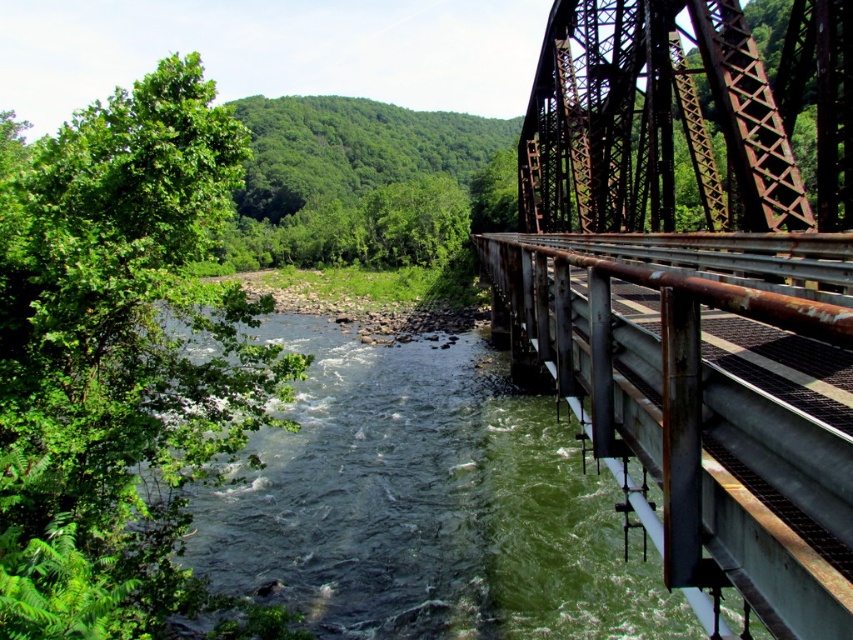
Which is behind, point (733, 500) or point (466, 518)?

Positioned behind is point (466, 518).

Which of these two, rusty metal bridge at right or green water at center, stands taller?

rusty metal bridge at right

Is point (706, 33) closer to camera compared to point (219, 486)?

Yes.

The height and width of the screenshot is (640, 853). Find the location of `rusty metal bridge at right`. rusty metal bridge at right is located at coordinates (693, 294).